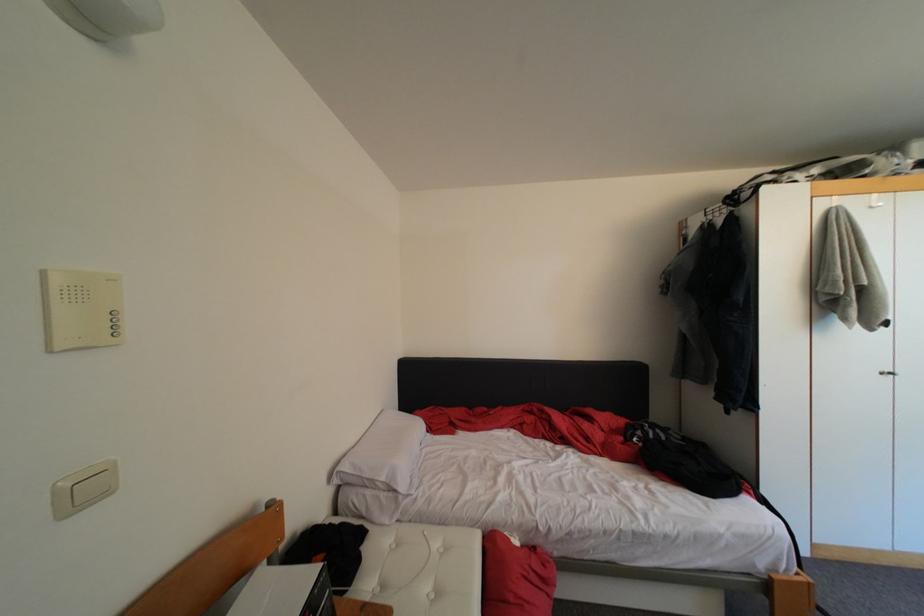
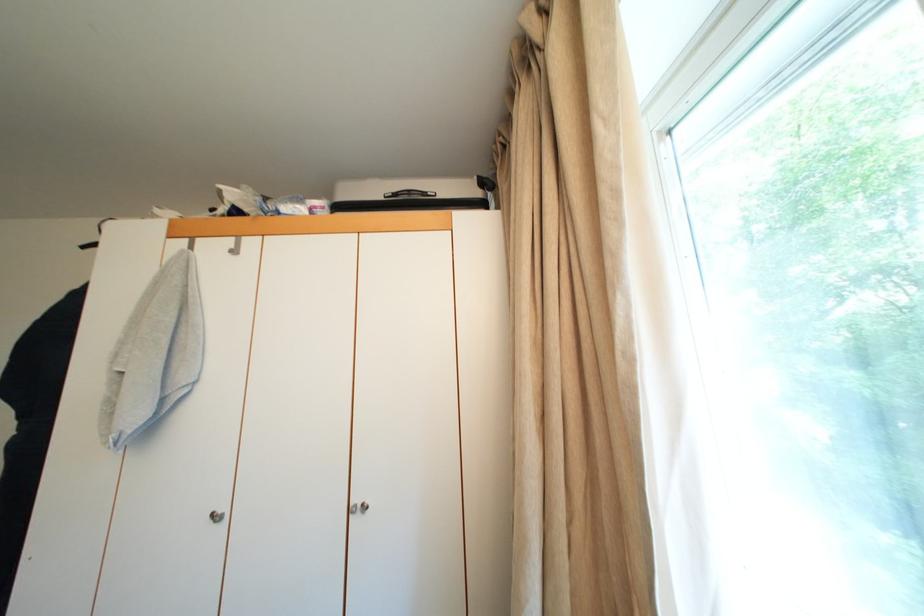
Question: In a continuous first-person perspective shot, in which direction is the camera moving?

Choices:
 (A) Left
 (B) Right
 (C) Forward
 (D) Backward

Answer: (B)